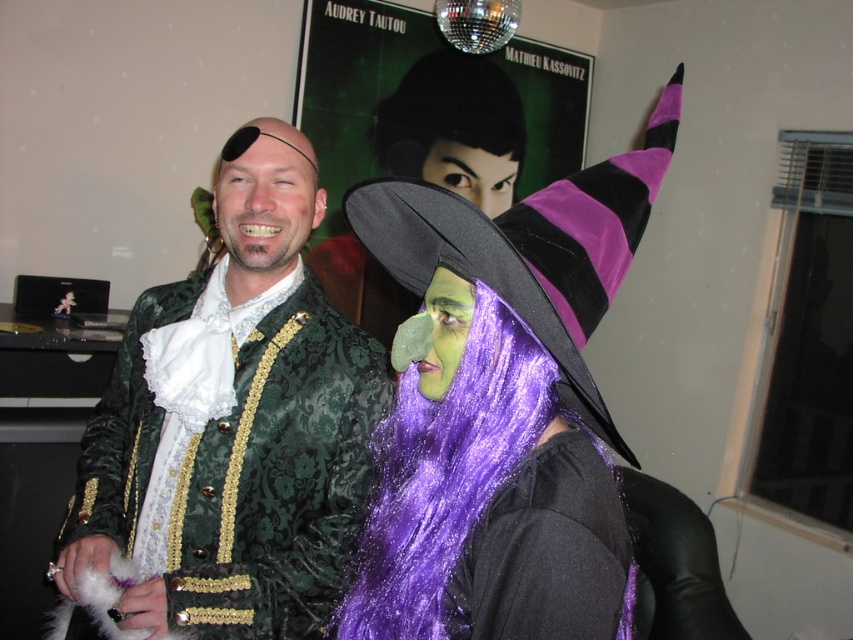
Is shiny green velvet jacket at left above purple satin witch hat at upper right?

Actually, shiny green velvet jacket at left is below purple satin witch hat at upper right.

Describe the element at coordinates (526, 378) in the screenshot. I see `shiny green velvet jacket at left` at that location.

You are a GUI agent. You are given a task and a screenshot of the screen. Output one action in this format:
    pyautogui.click(x=<x>, y=<y>)
    Task: Click on the shiny green velvet jacket at left
    This screenshot has width=853, height=640.
    Given the screenshot: What is the action you would take?
    pyautogui.click(x=526, y=378)

Can you confirm if shiny green velvet jacket at left is wider than purple glittery wig at center?

Yes.

Can you confirm if shiny green velvet jacket at left is smaller than purple glittery wig at center?

No, shiny green velvet jacket at left is not smaller than purple glittery wig at center.

Is point (143, 445) less distant than point (534, 435)?

No, it is behind (534, 435).

Locate an element on the screen. Image resolution: width=853 pixels, height=640 pixels. shiny green velvet jacket at left is located at coordinates (526, 378).

Which is more to the right, green velvet jacket at center or black shiny hair at upper center?

black shiny hair at upper center is more to the right.

Can you confirm if green velvet jacket at center is wider than black shiny hair at upper center?

In fact, green velvet jacket at center might be narrower than black shiny hair at upper center.

Locate an element on the screen. green velvet jacket at center is located at coordinates (234, 422).